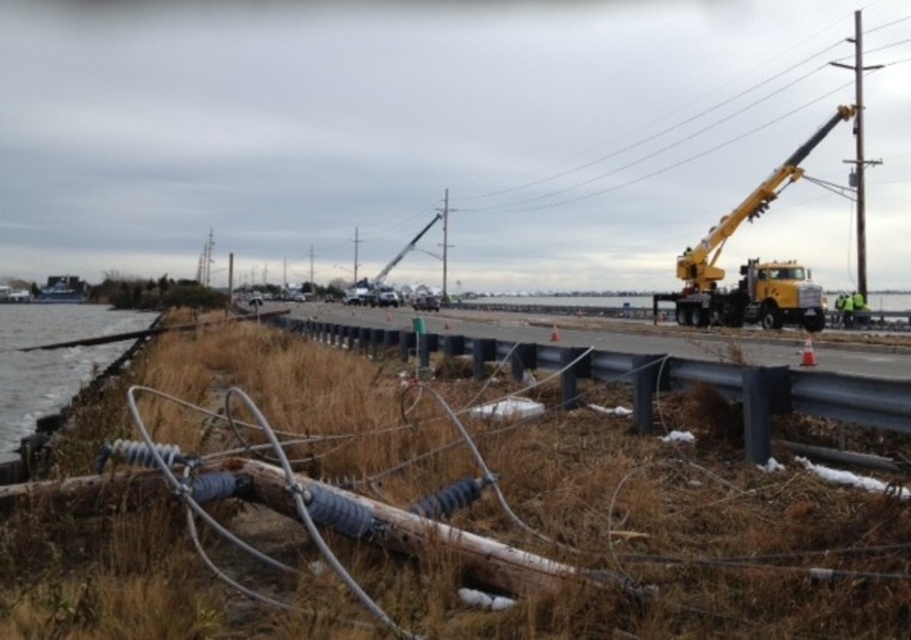
Question: Which point appears farthest from the camera in this image?

Choices:
 (A) (605, 481)
 (B) (855, 86)

Answer: (B)

Question: Estimate the real-world distances between objects in this image. Which object is farther from the clear water at lower left?

Choices:
 (A) metallic gray pole at upper right
 (B) brown dry grass at lower left
 (C) yellow metallic crane at right
 (D) black metal fence at center

Answer: (A)

Question: Is brown dry grass at lower left to the right of metallic gray pole at center from the viewer's perspective?

Choices:
 (A) no
 (B) yes

Answer: (B)

Question: Is metallic gray pole at upper right in front of metallic gray pole at center?

Choices:
 (A) yes
 (B) no

Answer: (A)

Question: In this image, where is black metal fence at center located relative to clear water at lower left?

Choices:
 (A) above
 (B) below

Answer: (B)

Question: Estimate the real-world distances between objects in this image. Which object is closer to the clear water at lower left?

Choices:
 (A) metallic gray pole at upper right
 (B) metallic gray pole at center
 (C) yellow metallic crane at right
 (D) brown dry grass at lower left

Answer: (D)